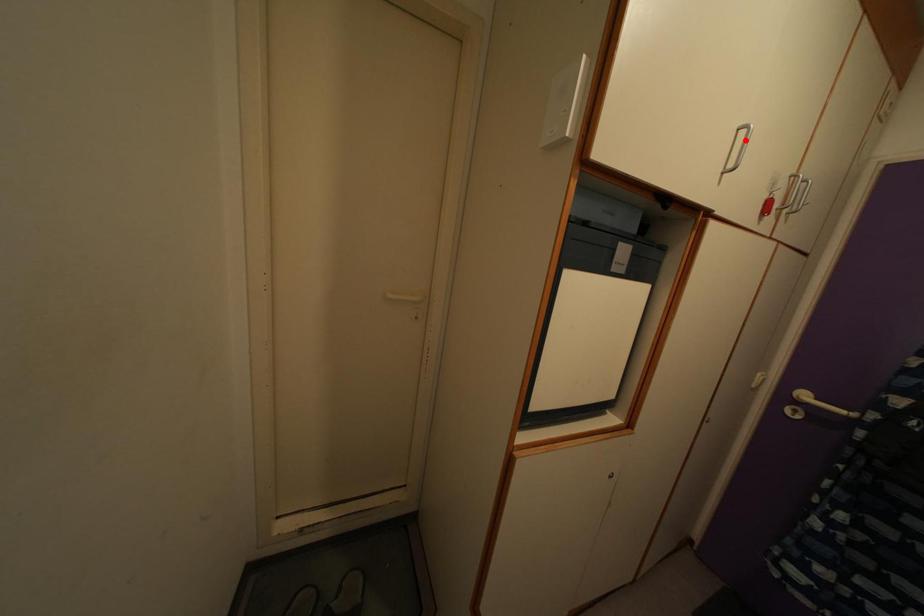
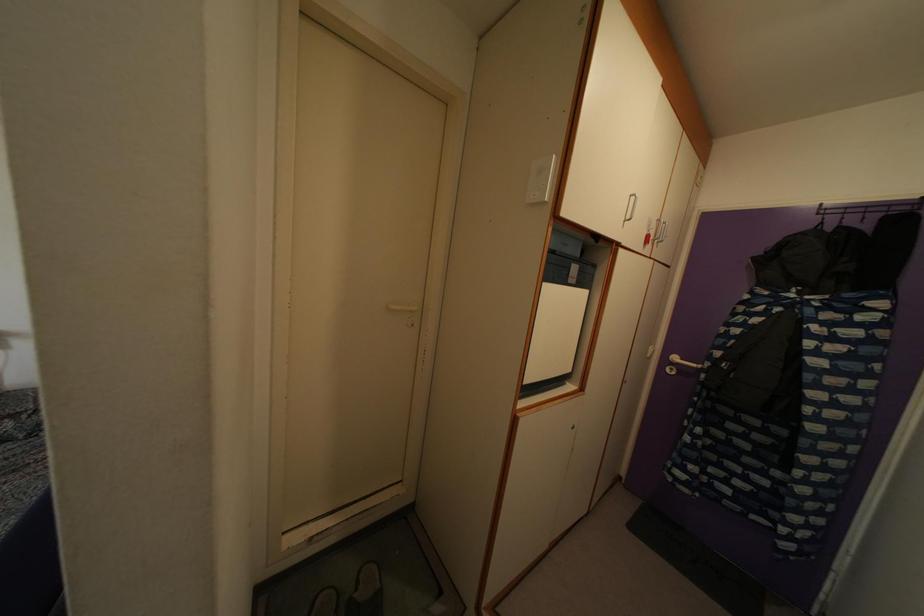
In the second image, find the point that corresponds to the highlighted location in the first image.

(636, 206)